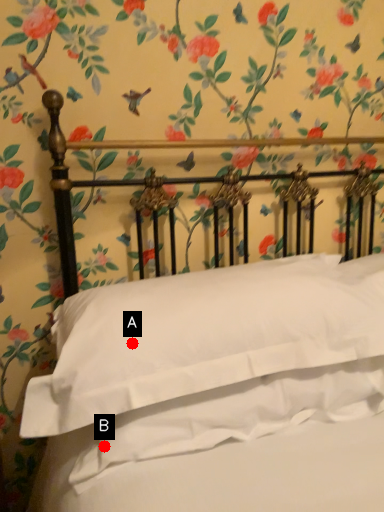
Question: Two points are circled on the image, labeled by A and B beside each circle. Which point is closer to the camera?

Choices:
 (A) A is closer
 (B) B is closer

Answer: (B)